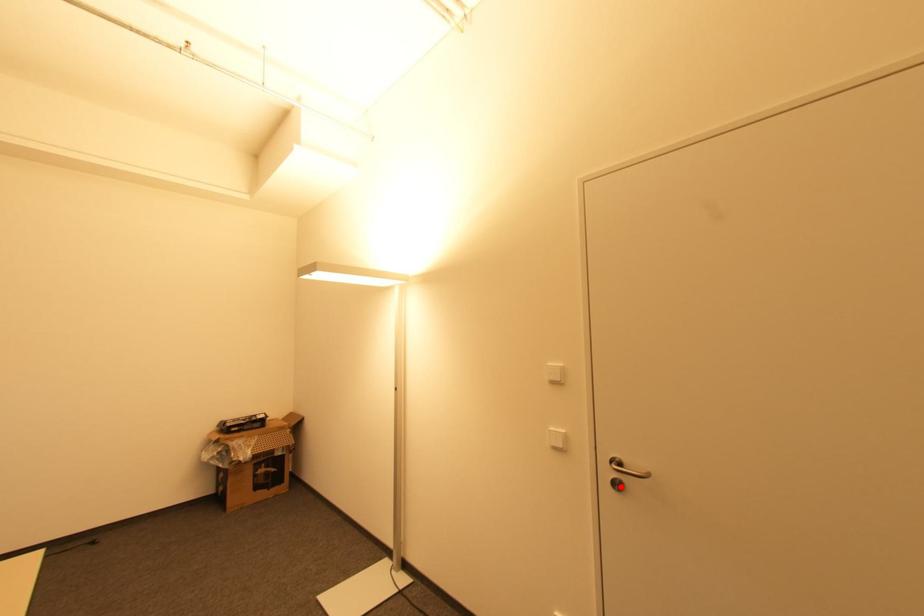
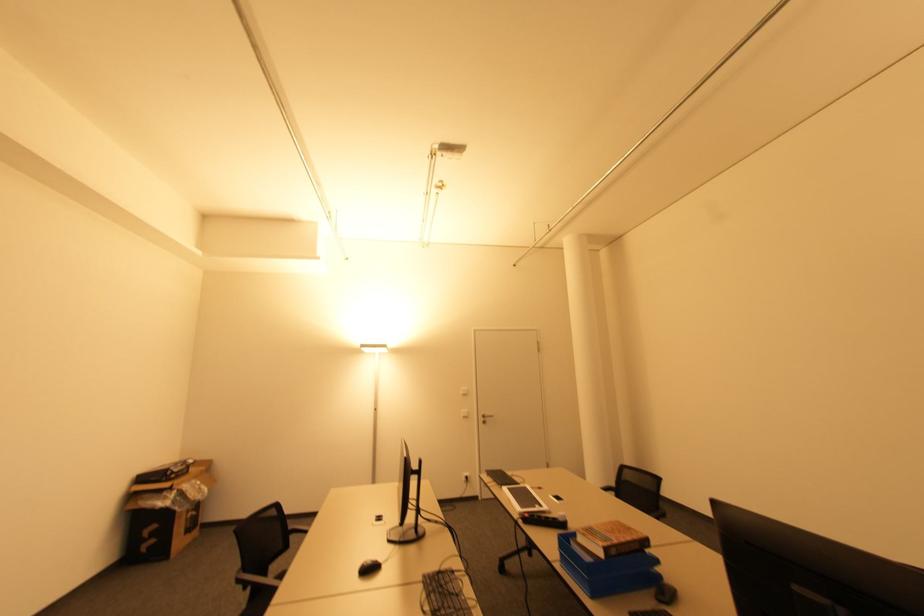
Locate, in the second image, the point that corresponds to the highlighted location in the first image.

(485, 422)